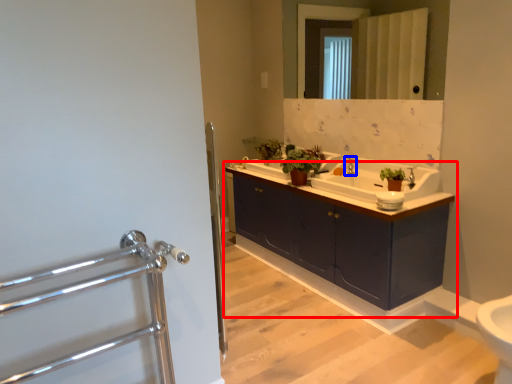
Question: Which object is closer to the camera taking this photo, bathroom cabinet (highlighted by a red box) or tap (highlighted by a blue box)?

Choices:
 (A) bathroom cabinet
 (B) tap

Answer: (A)